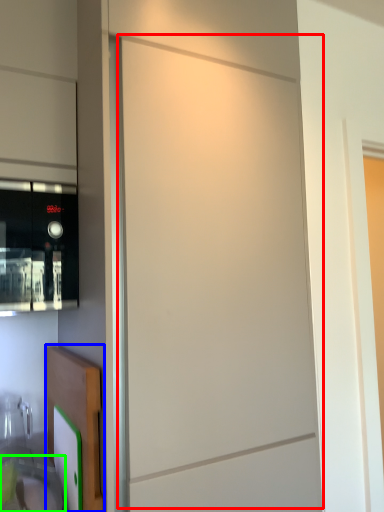
Question: Considering the real-world distances, which object is closest to screen door (highlighted by a red box)? cabinetry (highlighted by a blue box) or sink (highlighted by a green box).

Choices:
 (A) cabinetry
 (B) sink

Answer: (A)